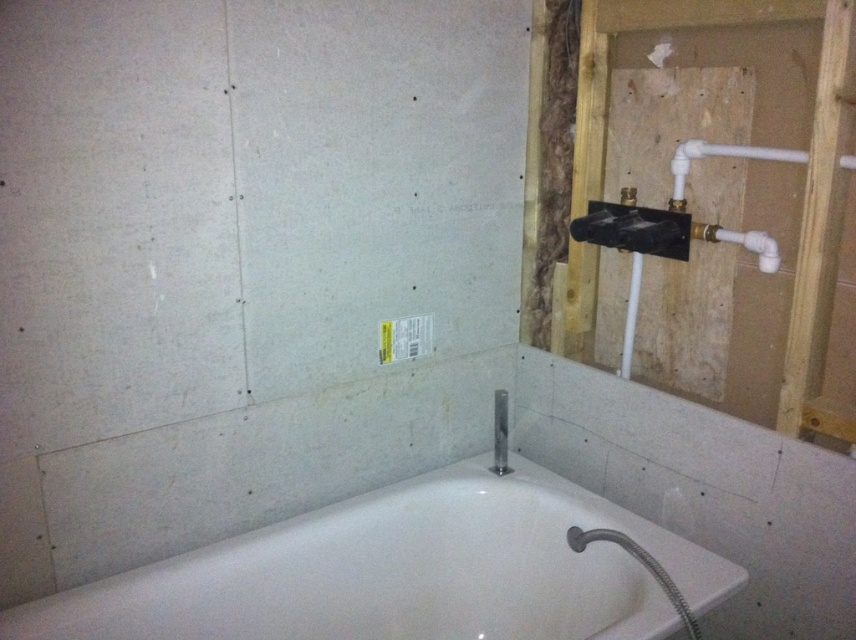
In the scene shown: You are a contractor working on a bathroom renovation. You need to install a new faucet that is the same size as the existing satin nickel showerhead at upper center. Can the existing white glossy bathtub at center accommodate this new faucet without any modifications?

The white glossy bathtub at center is larger in size than the satin nickel showerhead at upper center. Since the new faucet needs to be the same size as the showerhead, the bathtub can accommodate it without needing modifications because the existing bathtub has sufficient space.

You are an interior designer planning to install a new showerhead in the bathroom. The showerhead needs to be placed 1 meter away from the white glossy bathtub at center. Given the coordinates of the bathtub, can you determine if there is enough space to install the showerhead in the room?

The white glossy bathtub at center is located at point [406,572]. To determine if there is enough space to install the showerhead 1 meter away, we need to know the room dimensions. However, the provided information does not include the room size or other spatial constraints. Please provide additional details about the room dimensions to proceed.